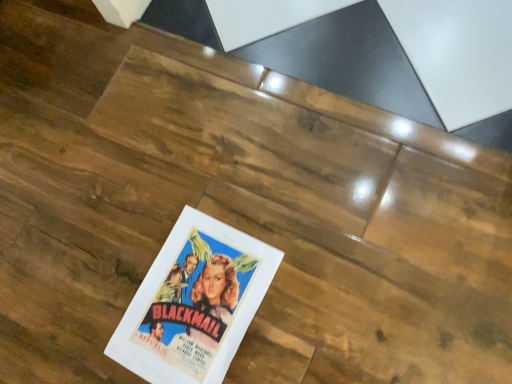
Where is `free point above matte paper poster at center (from a real-world perspective)`? Image resolution: width=512 pixels, height=384 pixels. free point above matte paper poster at center (from a real-world perspective) is located at coordinates (190, 299).